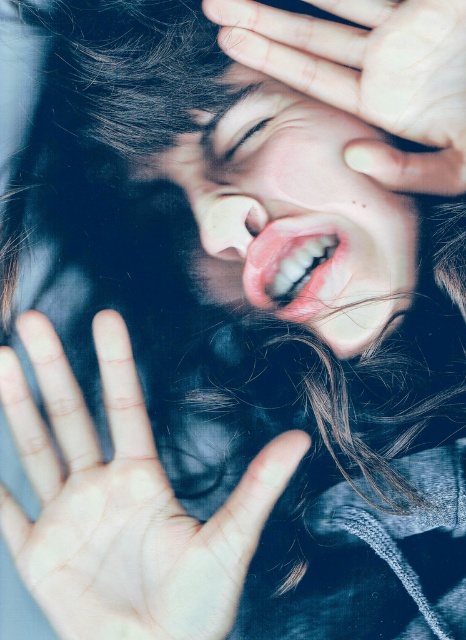
You are a photographer trying to capture a closeup of a hand. The subject has a smooth skin hand at upper center that you want to focus on. If your camera requires the subject to be at least 50 centimeters away to avoid blurring, will this distance work?

The smooth skin hand at upper center and camera are 48.78 centimeters apart from each other. Since the required distance is 50 centimeters, the current distance is too close, so the hand will likely be blurry in the photo.